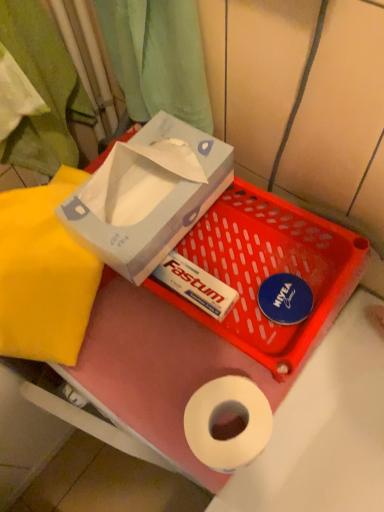
Where is `empty space that is ontop of white cardboard box at upper center, positioned as the first box in bottom-to-top order`? The image size is (384, 512). empty space that is ontop of white cardboard box at upper center, positioned as the first box in bottom-to-top order is located at coordinates (225, 308).